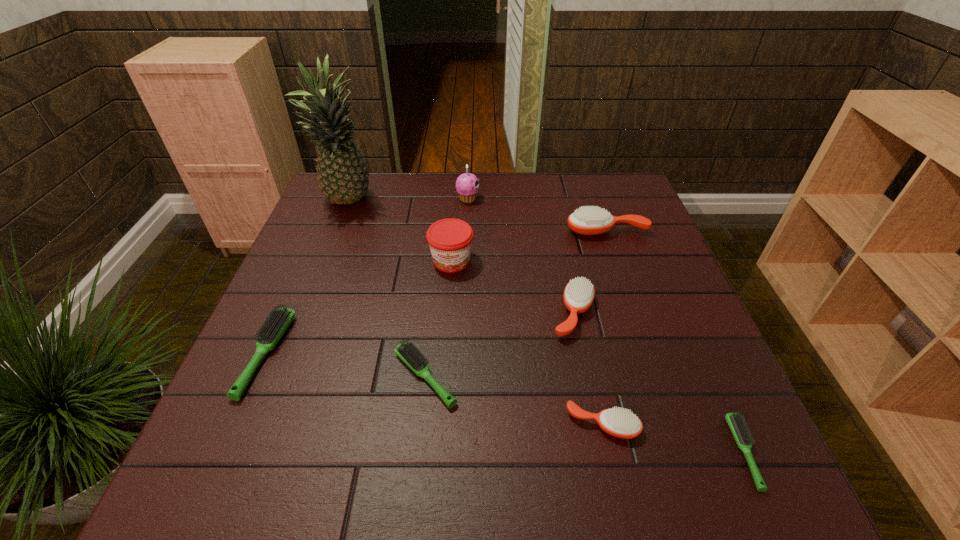
Find the location of a particular element. This screenshot has width=960, height=540. the biggest light hairbrush is located at coordinates (276, 324).

Where is `the smallest orange hairbrush`? The image size is (960, 540). the smallest orange hairbrush is located at coordinates (617, 422).

Find the location of a particular element. The width and height of the screenshot is (960, 540). the second light hairbrush from right to left is located at coordinates (406, 351).

I want to click on the second shortest hairbrush, so click(x=406, y=351).

Where is `the shortest object`? the shortest object is located at coordinates (735, 421).

Where is `the smallest light hairbrush`? The width and height of the screenshot is (960, 540). the smallest light hairbrush is located at coordinates (735, 421).

The height and width of the screenshot is (540, 960). I want to click on vacant space located on the front of the tallest object, so click(x=308, y=303).

Where is `vacant area situated on the face of the second tallest object`? Image resolution: width=960 pixels, height=540 pixels. vacant area situated on the face of the second tallest object is located at coordinates (593, 199).

The width and height of the screenshot is (960, 540). Find the location of `vacant space located on the label side of the seventh shortest object`. vacant space located on the label side of the seventh shortest object is located at coordinates (447, 315).

You are a GUI agent. You are given a task and a screenshot of the screen. Output one action in this format:
    pyautogui.click(x=<x>, y=<y>)
    Task: Click on the vacant region located 0.110m on the left of the farthest hairbrush
    This screenshot has height=540, width=960.
    Given the screenshot: What is the action you would take?
    pyautogui.click(x=527, y=231)